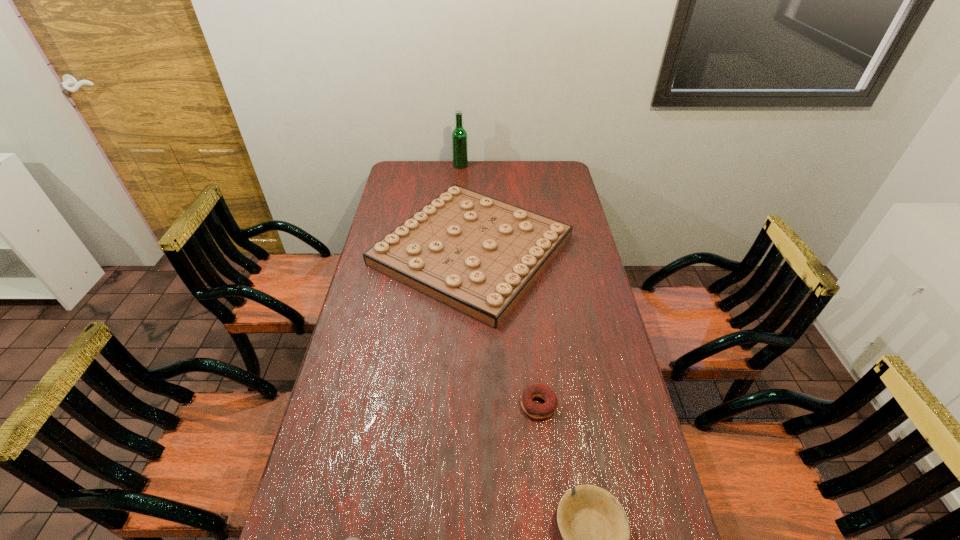
Locate an element on the screen. object located at the left edge is located at coordinates (479, 255).

Where is `object at the right edge`? The image size is (960, 540). object at the right edge is located at coordinates (479, 255).

The height and width of the screenshot is (540, 960). I want to click on vacant space at the far edge of the desktop, so click(442, 169).

The height and width of the screenshot is (540, 960). Identify the location of free space at the left edge of the desktop. (314, 505).

Where is `free space at the right edge of the desktop`? The image size is (960, 540). free space at the right edge of the desktop is located at coordinates (558, 208).

This screenshot has width=960, height=540. I want to click on the closest object to the thermos bottle, so click(595, 528).

Point out which object is positioned as the second nearest to the second shortest object. Please provide its 2D coordinates. Your answer should be formatted as a tuple, i.e. [(x, y)], where the tuple contains the x and y coordinates of a point satisfying the conditions above.

[(352, 539)]

I want to click on vacant space that satisfies the following two spatial constraints: 1. on the front side of the fourth nearest object; 2. on the left side of the shortest object, so click(x=468, y=405).